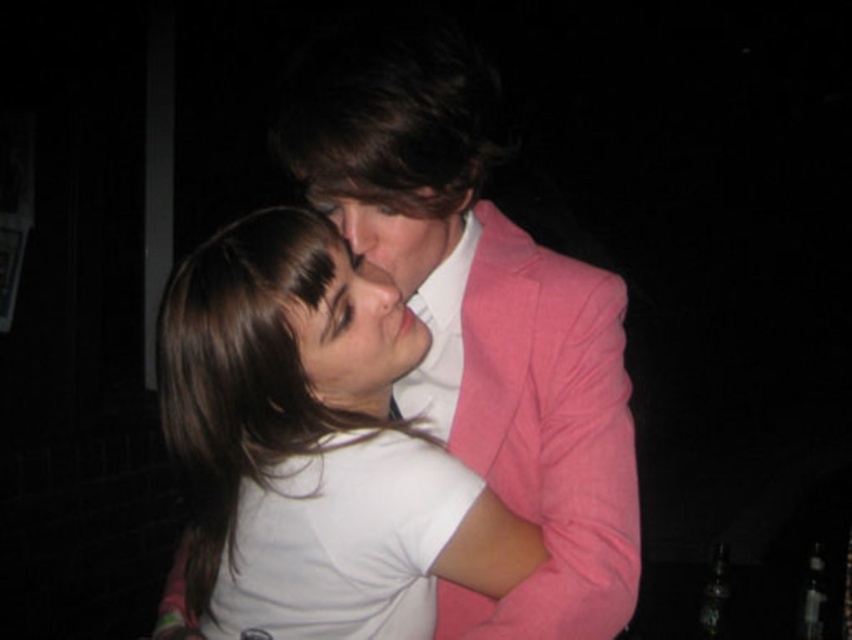
Who is positioned more to the right, pink fabric jacket at center or matte pink blazer at center?

pink fabric jacket at center is more to the right.

Is pink fabric jacket at center below matte pink blazer at center?

Yes.

This screenshot has width=852, height=640. Find the location of `pink fabric jacket at center`. pink fabric jacket at center is located at coordinates (481, 316).

Does white matte shirt at center lie in front of matte pink blazer at center?

Yes, it is.

Does point (235, 356) lie in front of point (346, 230)?

Yes, point (235, 356) is closer to viewer.

Find the location of a particular element. The width and height of the screenshot is (852, 640). white matte shirt at center is located at coordinates (311, 419).

Does matte white face at center appear under matte pink blazer at center?

Yes.

Who is lower down, matte white face at center or matte pink blazer at center?

Positioned lower is matte white face at center.

Is point (372, 316) behind point (353, 209)?

Yes, it is behind point (353, 209).

Image resolution: width=852 pixels, height=640 pixels. Find the location of `matte white face at center`. matte white face at center is located at coordinates (355, 332).